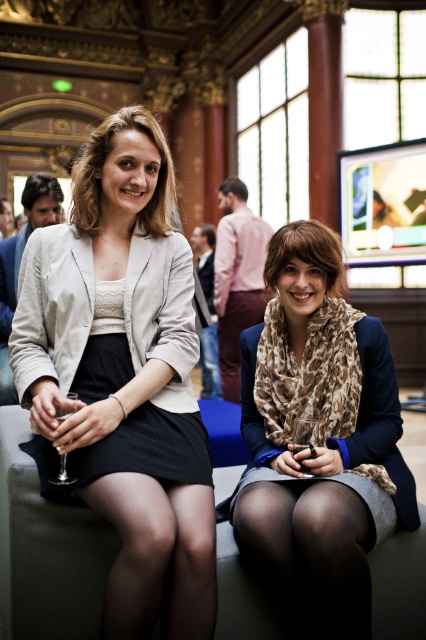
Can you confirm if matte beige blazer at center is positioned below matte beige dress at center?

Actually, matte beige blazer at center is above matte beige dress at center.

Does point (51, 236) come closer to viewer compared to point (94, 358)?

No, (51, 236) is further to viewer.

The width and height of the screenshot is (426, 640). I want to click on matte beige blazer at center, so click(x=123, y=376).

Who is positioned more to the right, matte beige blazer at upper left or matte black hair at upper left?

matte beige blazer at upper left

Is matte beige blazer at upper left taller than matte black hair at upper left?

Yes.

I want to click on matte beige blazer at upper left, so click(103, 164).

Which is behind, point (77, 200) or point (330, 278)?

Positioned behind is point (77, 200).

Is point (83, 148) farther from viewer compared to point (330, 266)?

That is True.

Is point (83, 200) farther from camera compared to point (302, 259)?

Yes, point (83, 200) is farther from viewer.

The height and width of the screenshot is (640, 426). Identify the location of matte beige blazer at upper left. (103, 164).